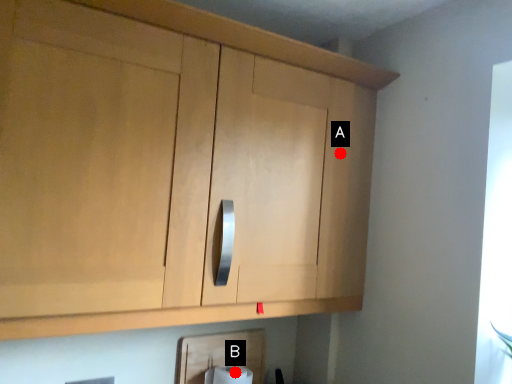
Question: Two points are circled on the image, labeled by A and B beside each circle. Which of the following is the farthest from the observer?

Choices:
 (A) A is further
 (B) B is further

Answer: (B)